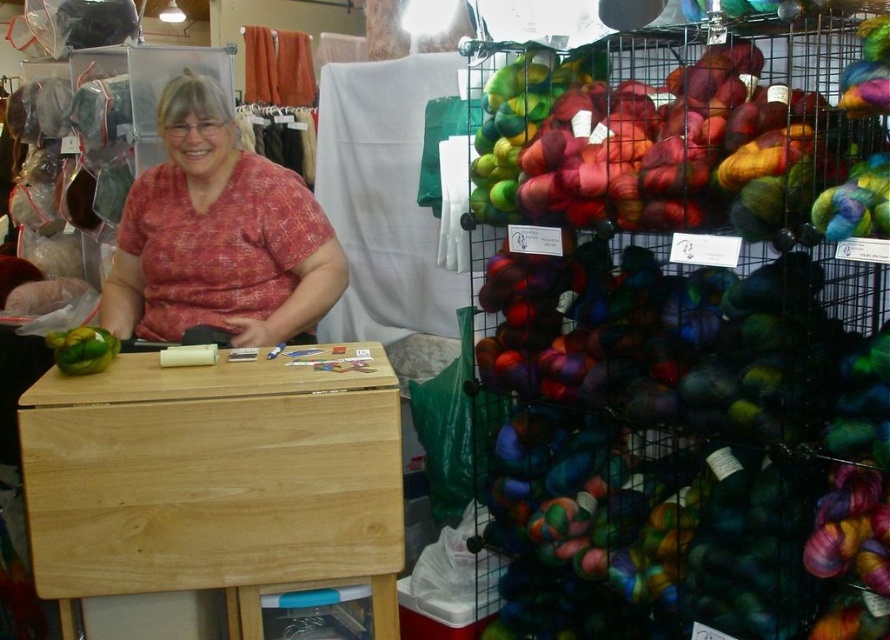
Question: Which point is farther from the camera taking this photo?

Choices:
 (A) (693, 184)
 (B) (120, 227)

Answer: (B)

Question: Can you confirm if multicolored yarn at right is wider than matte red shirt at center?

Choices:
 (A) yes
 (B) no

Answer: (A)

Question: Can you confirm if multicolored yarn at right is thinner than matte red shirt at center?

Choices:
 (A) yes
 (B) no

Answer: (B)

Question: Is the position of multicolored yarn at right less distant than that of matte red shirt at center?

Choices:
 (A) yes
 (B) no

Answer: (A)